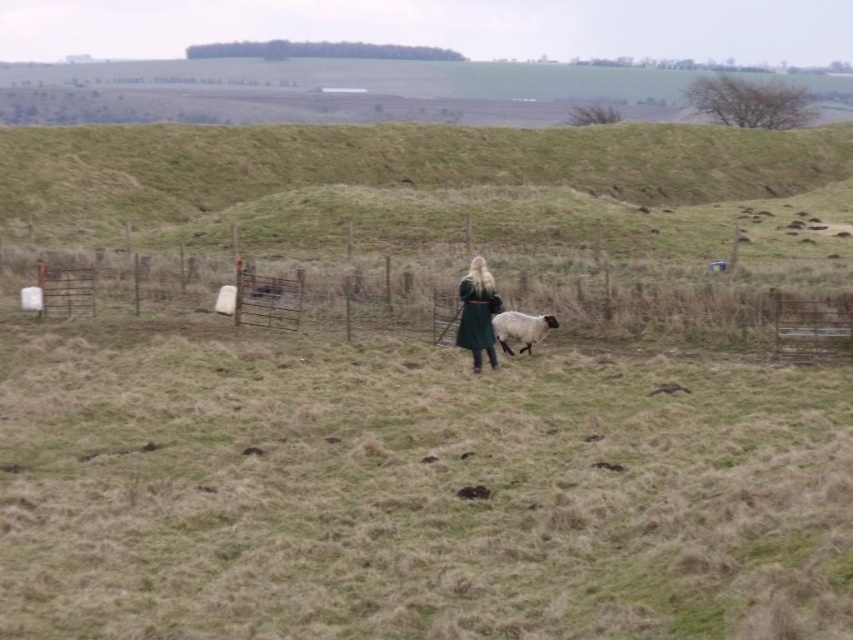
Does green woolen coat at center have a lesser height compared to white woolly sheep at center?

No.

Which is more to the right, green woolen coat at center or white woolly sheep at center?

white woolly sheep at center is more to the right.

This screenshot has width=853, height=640. I want to click on green woolen coat at center, so click(x=477, y=314).

The height and width of the screenshot is (640, 853). What are the coordinates of `green woolen coat at center` in the screenshot? It's located at (477, 314).

Is metal wire fence at center taller than green woolen coat at center?

Yes.

Does metal wire fence at center appear on the right side of green woolen coat at center?

In fact, metal wire fence at center is to the left of green woolen coat at center.

Where is `metal wire fence at center`? metal wire fence at center is located at coordinates (242, 289).

The width and height of the screenshot is (853, 640). I want to click on metal wire fence at center, so click(x=242, y=289).

Between point (723, 605) and point (497, 308), which one is positioned in front?

Point (723, 605) is more forward.

Measure the distance from green grassy field at center to green woolen coat at center.

green grassy field at center and green woolen coat at center are 3.90 meters apart from each other.

Locate an element on the screen. green grassy field at center is located at coordinates (413, 492).

Image resolution: width=853 pixels, height=640 pixels. I want to click on green grassy field at center, so (x=413, y=492).